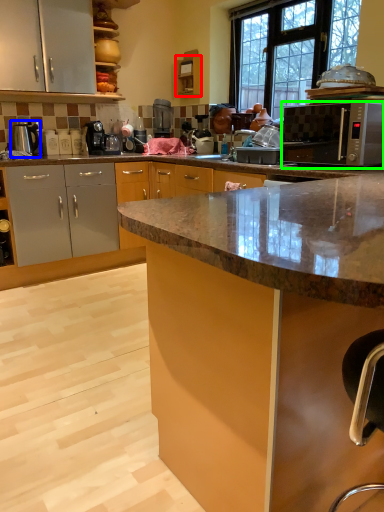
Question: Estimate the real-world distances between objects in this image. Which object is closer to cabinetry (highlighted by a red box), appliance (highlighted by a blue box) or microwave oven (highlighted by a green box)?

Choices:
 (A) appliance
 (B) microwave oven

Answer: (B)